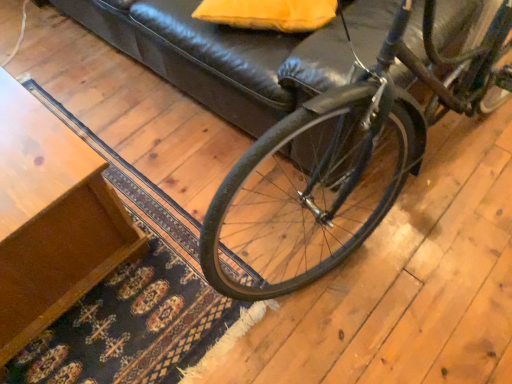
Question: In terms of width, does wooden table at lower left look wider or thinner when compared to matte yellow pillow at upper center?

Choices:
 (A) wide
 (B) thin

Answer: (A)

Question: Would you say wooden table at lower left is to the left or to the right of matte yellow pillow at upper center in the picture?

Choices:
 (A) left
 (B) right

Answer: (A)

Question: Which of these objects is positioned farthest from the wooden table at lower left?

Choices:
 (A) matte yellow pillow at upper center
 (B) shiny black bicycle at center

Answer: (A)

Question: Which object is positioned farthest from the shiny black bicycle at center?

Choices:
 (A) matte yellow pillow at upper center
 (B) wooden table at lower left

Answer: (B)